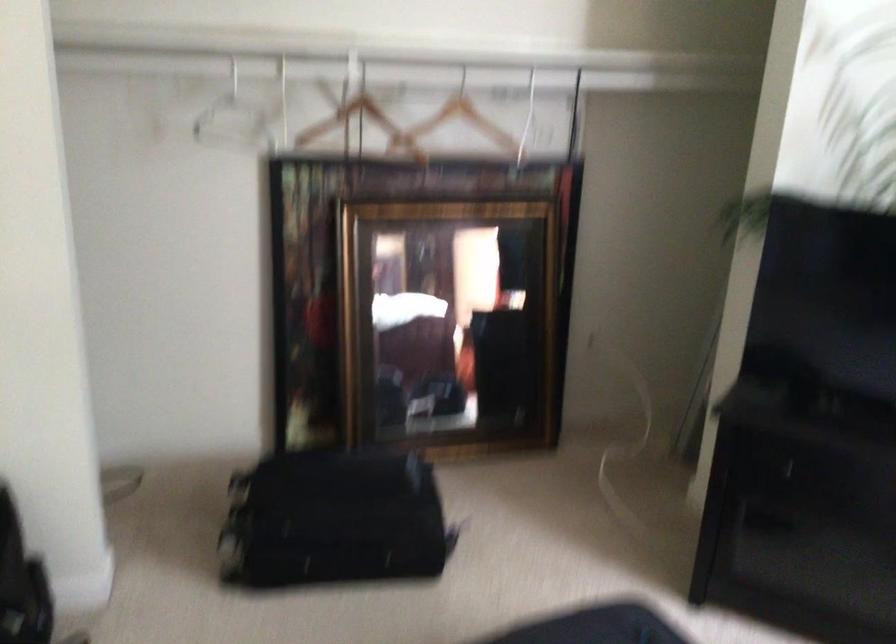
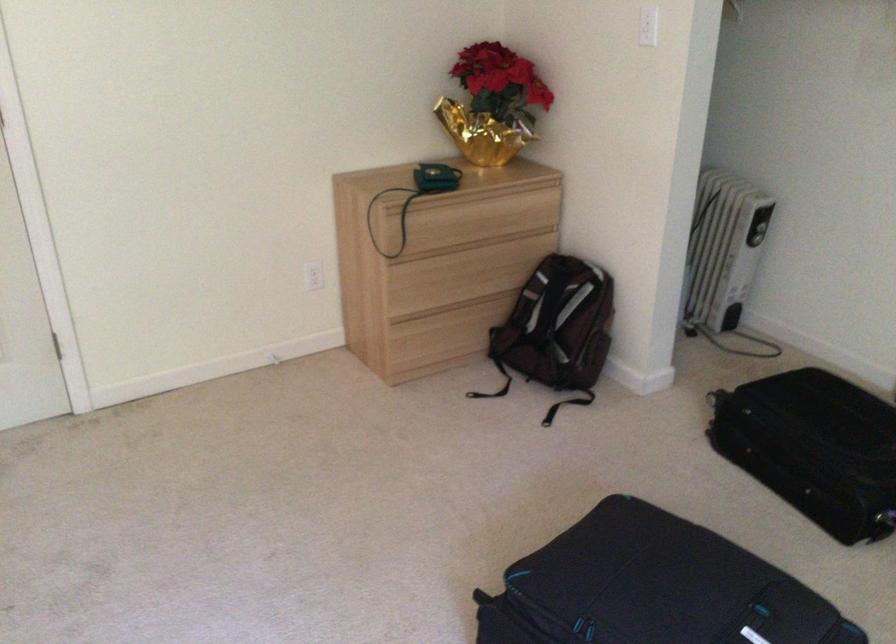
The point at (x=455, y=529) is marked in the first image. Where is the corresponding point in the second image?

(883, 509)